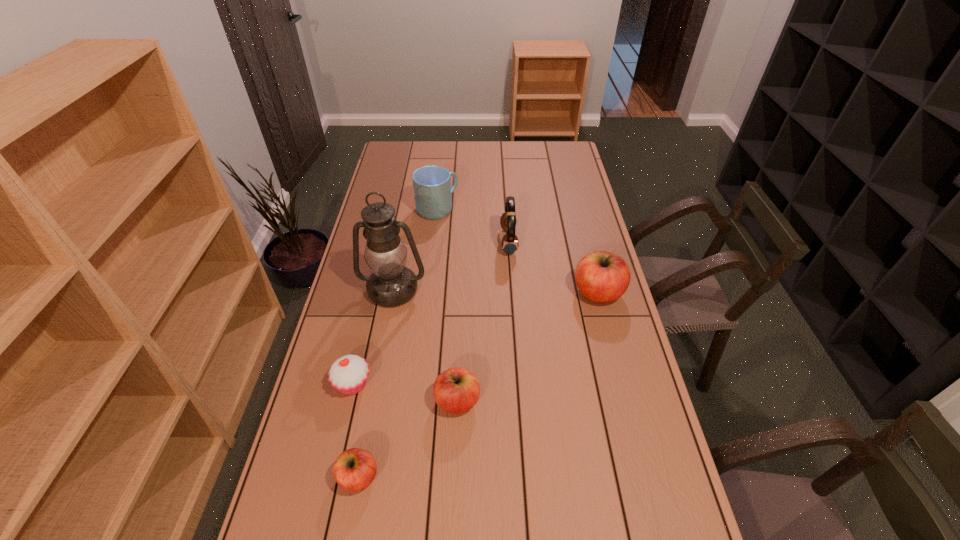
The height and width of the screenshot is (540, 960). Find the location of `free spot between the sixth nearest object and the cupcake`. free spot between the sixth nearest object and the cupcake is located at coordinates (431, 313).

Find the location of a particular element. free space between the second farthest apple and the leftmost apple is located at coordinates (408, 439).

Identify the location of vacant space that's between the second nearest apple and the farthest object. (447, 305).

This screenshot has height=540, width=960. I want to click on unoccupied position between the nearest apple and the tallest object, so (x=376, y=383).

This screenshot has width=960, height=540. I want to click on free space between the cupcake and the sixth object from left to right, so click(431, 313).

This screenshot has height=540, width=960. Identify the location of free space between the farthest object and the rightmost apple. (517, 251).

Locate an element on the screen. This screenshot has height=540, width=960. vacant region between the shortest object and the second tallest apple is located at coordinates (408, 439).

Select which object is the sixth closest to the farthest apple. Please provide its 2D coordinates. Your answer should be formatted as a tuple, i.e. [(x, y)], where the tuple contains the x and y coordinates of a point satisfying the conditions above.

[(354, 469)]

You are a GUI agent. You are given a task and a screenshot of the screen. Output one action in this format:
    pyautogui.click(x=<x>, y=<y>)
    Task: Click on the sixth closest object to the oil lamp
    
    Given the screenshot: What is the action you would take?
    602,277

Select which apple is the third closest to the sixth object from left to right. Please provide its 2D coordinates. Your answer should be formatted as a tuple, i.e. [(x, y)], where the tuple contains the x and y coordinates of a point satisfying the conditions above.

[(354, 469)]